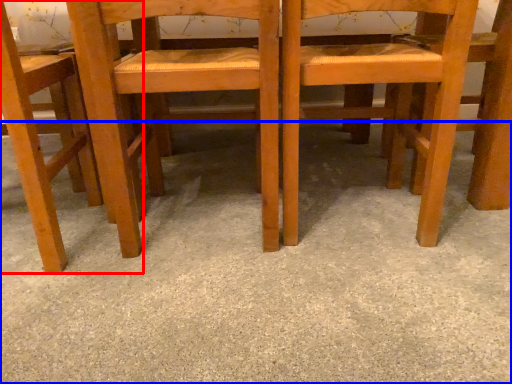
Question: Which object appears closest to the camera in this image, chair (highlighted by a red box) or concrete (highlighted by a blue box)?

Choices:
 (A) chair
 (B) concrete

Answer: (B)